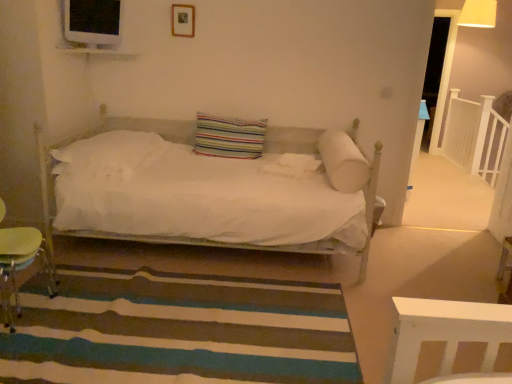
What do you see at coordinates (178, 331) in the screenshot?
I see `striped carpet at lower center` at bounding box center [178, 331].

Describe the element at coordinates (475, 136) in the screenshot. I see `white wooden balustrade at upper right` at that location.

Image resolution: width=512 pixels, height=384 pixels. I want to click on striped carpet at lower center, so click(x=178, y=331).

Can you confirm if striped carpet at lower center is positioned to the right of wooden lampshade at upper right?

Incorrect, striped carpet at lower center is not on the right side of wooden lampshade at upper right.

Can you see striped carpet at lower center touching wooden lampshade at upper right?

No, striped carpet at lower center is not next to wooden lampshade at upper right.

Who is smaller, striped carpet at lower center or wooden lampshade at upper right?

wooden lampshade at upper right is smaller.

From a real-world perspective, which is physically below, striped carpet at lower center or wooden lampshade at upper right?

striped carpet at lower center.

Looking at this image, from a real-world perspective, is white soft pillow at right, which ranks as the first pillow in right-to-left order, above or below striped carpet at lower center?

white soft pillow at right, which ranks as the first pillow in right-to-left order, is above striped carpet at lower center.

Is striped carpet at lower center at the back of white soft pillow at right, which ranks as the first pillow in right-to-left order?

No, striped carpet at lower center is not at the back of white soft pillow at right, which ranks as the first pillow in right-to-left order.

Is point (356, 177) closer or farther from the camera than point (108, 285)?

Point (356, 177).

Could you tell me if white soft pillow at center, acting as the 3th pillow starting from the right, is turned towards striped fabric pillow at center, placed as the 2th pillow when sorted from left to right?

No, white soft pillow at center, acting as the 3th pillow starting from the right, is not facing towards striped fabric pillow at center, placed as the 2th pillow when sorted from left to right.

From a real-world perspective, which is physically below, white soft pillow at center, acting as the 3th pillow starting from the right, or striped fabric pillow at center, acting as the second pillow starting from the right?

white soft pillow at center, acting as the 3th pillow starting from the right, is physically lower.

Identify the location of the 1st pillow to the right when counting from the white soft pillow at center, acting as the 3th pillow starting from the right. The image size is (512, 384). (229, 137).

How distant is white soft pillow at center, positioned as the first pillow in left-to-right order, from striped fabric pillow at center, placed as the 2th pillow when sorted from left to right?

A distance of 60.15 centimeters exists between white soft pillow at center, positioned as the first pillow in left-to-right order, and striped fabric pillow at center, placed as the 2th pillow when sorted from left to right.

Is white soft pillow at right, which ranks as the first pillow in right-to-left order, in contact with green plastic swivel chair at lower left?

white soft pillow at right, which ranks as the first pillow in right-to-left order, and green plastic swivel chair at lower left are not in contact.

Looking at this image, between white soft pillow at right, which ranks as the 3th pillow in left-to-right order, and green plastic swivel chair at lower left, which one has larger size?

With larger size is green plastic swivel chair at lower left.

How different are the orientations of white soft pillow at right, which ranks as the first pillow in right-to-left order, and green plastic swivel chair at lower left in degrees?

The angle between the facing direction of white soft pillow at right, which ranks as the first pillow in right-to-left order, and the facing direction of green plastic swivel chair at lower left is 88.4 degrees.

Where is `swivel chair directly beneath the white soft pillow at right, which ranks as the first pillow in right-to-left order (from a real-world perspective)`? This screenshot has height=384, width=512. swivel chair directly beneath the white soft pillow at right, which ranks as the first pillow in right-to-left order (from a real-world perspective) is located at coordinates (21, 265).

Can you confirm if white wooden balustrade at upper right is wider than wooden picture frame at upper center?

Yes.

Based on the photo, is white wooden balustrade at upper right oriented towards wooden picture frame at upper center?

No, white wooden balustrade at upper right is not facing towards wooden picture frame at upper center.

The height and width of the screenshot is (384, 512). What are the coordinates of `balustrade on the right side of wooden picture frame at upper center` in the screenshot? It's located at (475, 136).

From the image's perspective, between white wooden balustrade at upper right and wooden picture frame at upper center, who is located below?

white wooden balustrade at upper right, from the image's perspective.

Is point (338, 156) closer or farther from the camera than point (128, 156)?

Point (338, 156) appears to be closer to the viewer than point (128, 156).

Which pillow is the 2nd one when counting from the right side of the white soft pillow at center, acting as the 3th pillow starting from the right? Please provide its 2D coordinates.

[(343, 161)]

From the image's perspective, is white soft pillow at right, which ranks as the 3th pillow in left-to-right order, located above or below white soft pillow at center, positioned as the first pillow in left-to-right order?

From the image's perspective, white soft pillow at right, which ranks as the 3th pillow in left-to-right order, appears below white soft pillow at center, positioned as the first pillow in left-to-right order.

Between white soft pillow at right, which ranks as the 3th pillow in left-to-right order, and white soft pillow at center, acting as the 3th pillow starting from the right, which one has more height?

Standing taller between the two is white soft pillow at right, which ranks as the 3th pillow in left-to-right order.

Which object is closer to the camera, wooden picture frame at upper center or white soft pillow at right, which ranks as the first pillow in right-to-left order?

Positioned in front is white soft pillow at right, which ranks as the first pillow in right-to-left order.

From the image's perspective, is wooden picture frame at upper center located beneath white soft pillow at right, which ranks as the 3th pillow in left-to-right order?

No, from the image's perspective, wooden picture frame at upper center is not below white soft pillow at right, which ranks as the 3th pillow in left-to-right order.

From their relative heights in the image, would you say wooden picture frame at upper center is taller or shorter than white soft pillow at right, which ranks as the first pillow in right-to-left order?

In the image, wooden picture frame at upper center appears to be shorter than white soft pillow at right, which ranks as the first pillow in right-to-left order.

Is point (192, 21) closer or farther from the camera than point (355, 155)?

Point (192, 21) appears to be farther away from the viewer than point (355, 155).

The width and height of the screenshot is (512, 384). Identify the location of stripe in front of the wooden lampshade at upper right. (178, 331).

The width and height of the screenshot is (512, 384). Find the location of `stripe below the white soft pillow at right, which ranks as the 3th pillow in left-to-right order (from the image's perspective)`. stripe below the white soft pillow at right, which ranks as the 3th pillow in left-to-right order (from the image's perspective) is located at coordinates (178, 331).

Considering their positions, is white soft pillow at right, which ranks as the 3th pillow in left-to-right order, positioned closer to wooden picture frame at upper center than white soft pillow at center, positioned as the first pillow in left-to-right order?

Based on the image, white soft pillow at center, positioned as the first pillow in left-to-right order, appears to be nearer to wooden picture frame at upper center.

Which object lies nearer to the anchor point white soft pillow at right, which ranks as the first pillow in right-to-left order, white soft pillow at center, positioned as the first pillow in left-to-right order, or green plastic swivel chair at lower left?

Based on the image, white soft pillow at center, positioned as the first pillow in left-to-right order, appears to be nearer to white soft pillow at right, which ranks as the first pillow in right-to-left order.

Based on their spatial positions, is white soft pillow at right, which ranks as the first pillow in right-to-left order, or white wooden balustrade at upper right further from wooden picture frame at upper center?

white wooden balustrade at upper right is further to wooden picture frame at upper center.

When comparing their distances from white soft pillow at right, which ranks as the first pillow in right-to-left order, does white wooden balustrade at upper right or striped fabric pillow at center, acting as the second pillow starting from the right, seem closer?

striped fabric pillow at center, acting as the second pillow starting from the right.

Based on their spatial positions, is striped carpet at lower center or white soft pillow at right, which ranks as the 3th pillow in left-to-right order, further from white wooden balustrade at upper right?

Among the two, striped carpet at lower center is located further to white wooden balustrade at upper right.

Based on their spatial positions, is wooden picture frame at upper center or green plastic swivel chair at lower left further from wooden lampshade at upper right?

green plastic swivel chair at lower left.

Based on their spatial positions, is striped fabric pillow at center, placed as the 2th pillow when sorted from left to right, or white wooden balustrade at upper right closer to wooden lampshade at upper right?

The object closer to wooden lampshade at upper right is white wooden balustrade at upper right.

Estimate the real-world distances between objects in this image. Which object is further from striped fabric pillow at center, placed as the 2th pillow when sorted from left to right, striped carpet at lower center or white soft pillow at center, acting as the 3th pillow starting from the right?

Among the two, striped carpet at lower center is located further to striped fabric pillow at center, placed as the 2th pillow when sorted from left to right.

Locate an element on the screen. The width and height of the screenshot is (512, 384). swivel chair between striped carpet at lower center and striped fabric pillow at center, acting as the second pillow starting from the right, along the z-axis is located at coordinates (21, 265).

Find the location of a particular element. The image size is (512, 384). stripe between white soft pillow at center, acting as the 3th pillow starting from the right, and white wooden balustrade at upper right, in the horizontal direction is located at coordinates (178, 331).

Where is `lamp between green plastic swivel chair at lower left and white wooden balustrade at upper right from left to right`? Image resolution: width=512 pixels, height=384 pixels. lamp between green plastic swivel chair at lower left and white wooden balustrade at upper right from left to right is located at coordinates (478, 14).

Locate an element on the screen. This screenshot has height=384, width=512. lamp situated between wooden picture frame at upper center and white wooden balustrade at upper right from left to right is located at coordinates (478, 14).